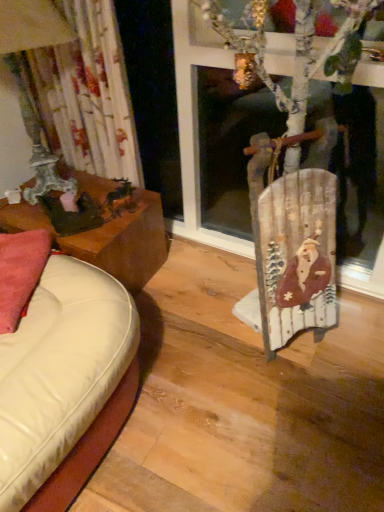
What do you see at coordinates (20, 273) in the screenshot? I see `pink fabric pillow at left` at bounding box center [20, 273].

Describe the element at coordinates (88, 94) in the screenshot. I see `floral fabric curtain at left` at that location.

What is the approximate width of floral fabric curtain at left?

The width of floral fabric curtain at left is 13.83 inches.

Where is `wooden sled at right`? wooden sled at right is located at coordinates (292, 242).

Identify the location of chair that appears above the brown wooden table at left (from a real-world perspective). This screenshot has width=384, height=512. (292, 242).

Is wooden sled at right oriented away from brown wooden table at left?

No, wooden sled at right is not facing the opposite direction of brown wooden table at left.

Does wooden sled at right lie behind brown wooden table at left?

No, wooden sled at right is in front of brown wooden table at left.

Looking at this image, from a real-world perspective, between brown wooden table at left and wooden sled at right, who is vertically lower?

brown wooden table at left is physically lower.

From the picture: Which of these two, brown wooden table at left or wooden sled at right, stands taller?

With more height is wooden sled at right.

Is brown wooden table at left inside or outside of wooden sled at right?

The correct answer is: outside.

Is brown wooden table at left looking in the opposite direction of wooden sled at right?

brown wooden table at left is not turned away from wooden sled at right.

From a real-world perspective, who is located lower, brown wooden table at left or floral fabric curtain at left?

brown wooden table at left is physically lower.

Between brown wooden table at left and floral fabric curtain at left, which one has more height?

Standing taller between the two is floral fabric curtain at left.

Between brown wooden table at left and floral fabric curtain at left, which one has smaller size?

Smaller between the two is floral fabric curtain at left.

Is point (73, 243) positioned after point (110, 7)?

Yes, it is behind point (110, 7).

Is pink fabric pillow at left taller or shorter than brown wooden table at left?

Clearly, pink fabric pillow at left is shorter compared to brown wooden table at left.

From a real-world perspective, does pink fabric pillow at left stand above brown wooden table at left?

Indeed, from a real-world perspective, pink fabric pillow at left stands above brown wooden table at left.

Between pink fabric pillow at left and brown wooden table at left, which one has smaller size?

Smaller between the two is pink fabric pillow at left.

Would you say pink fabric pillow at left is inside or outside brown wooden table at left?

pink fabric pillow at left is not inside brown wooden table at left, it's outside.

In the scene shown: Can you tell me how much brown wooden table at left and pink fabric pillow at left differ in facing direction?

There is a 29.1-degree angle between the facing directions of brown wooden table at left and pink fabric pillow at left.

Would you say brown wooden table at left contains pink fabric pillow at left?

No, pink fabric pillow at left is not surrounded by brown wooden table at left.

Considering the points (151, 227) and (21, 263), which point is behind, point (151, 227) or point (21, 263)?

Positioned behind is point (151, 227).

Does brown wooden table at left come in front of pink fabric pillow at left?

No, the depth of brown wooden table at left is greater than that of pink fabric pillow at left.

From a real-world perspective, relative to brown wooden table at left, is floral fabric curtain at left vertically above or below?

floral fabric curtain at left is situated higher than brown wooden table at left in the real world.

Is floral fabric curtain at left directly adjacent to brown wooden table at left?

floral fabric curtain at left and brown wooden table at left are clearly separated.

Does floral fabric curtain at left have a greater height compared to brown wooden table at left?

Correct, floral fabric curtain at left is much taller as brown wooden table at left.

Could you tell me if floral fabric curtain at left is turned towards brown wooden table at left?

No, floral fabric curtain at left is not aimed at brown wooden table at left.

Looking at this image, is floral fabric curtain at left closer to the viewer compared to pink fabric pillow at left?

No, it is behind pink fabric pillow at left.

Considering the positions of point (78, 112) and point (11, 310), is point (78, 112) closer or farther from the camera than point (11, 310)?

Point (78, 112) is farther from the camera than point (11, 310).

From a real-world perspective, between floral fabric curtain at left and pink fabric pillow at left, who is vertically higher?

In real-world perspective, floral fabric curtain at left is above.

Are floral fabric curtain at left and pink fabric pillow at left located far from each other?

floral fabric curtain at left is near pink fabric pillow at left, not far away.

You are a GUI agent. You are given a task and a screenshot of the screen. Output one action in this format:
    pyautogui.click(x=<x>, y=<y>)
    Task: Click on the table above the wooden sled at right (from the image's perspective)
    This screenshot has width=384, height=512.
    Given the screenshot: What is the action you would take?
    click(x=107, y=238)

The image size is (384, 512). In the image, there is a brown wooden table at left. What are the coordinates of `chair below it (from the image's perspective)` in the screenshot? It's located at (292, 242).

Looking at the image, which one is located further to pink fabric pillow at left, brown wooden table at left or wooden sled at right?

wooden sled at right is positioned further to the anchor pink fabric pillow at left.

Considering their positions, is pink fabric pillow at left positioned further to floral fabric curtain at left than brown wooden table at left?

pink fabric pillow at left is further to floral fabric curtain at left.

From the image, which object appears to be farther from pink fabric pillow at left, floral fabric curtain at left or wooden sled at right?

wooden sled at right is further to pink fabric pillow at left.

Looking at the image, which one is located further to wooden sled at right, pink fabric pillow at left or brown wooden table at left?

pink fabric pillow at left is positioned further to the anchor wooden sled at right.

Which object lies further to the anchor point pink fabric pillow at left, wooden sled at right or floral fabric curtain at left?

The object further to pink fabric pillow at left is wooden sled at right.

Which object lies further to the anchor point wooden sled at right, floral fabric curtain at left or brown wooden table at left?

floral fabric curtain at left lies further to wooden sled at right than the other object.

Looking at this image, from the image, which object appears to be farther from floral fabric curtain at left, wooden sled at right or pink fabric pillow at left?

The object further to floral fabric curtain at left is wooden sled at right.

From the image, which object appears to be farther from wooden sled at right, floral fabric curtain at left or pink fabric pillow at left?

floral fabric curtain at left is further to wooden sled at right.

Locate an element on the screen. The height and width of the screenshot is (512, 384). table between floral fabric curtain at left and wooden sled at right from left to right is located at coordinates (107, 238).

Identify the location of pillow situated between floral fabric curtain at left and wooden sled at right from left to right. [20, 273].

At what (x,y) coordinates should I click in order to perform the action: click on table between floral fabric curtain at left and pink fabric pillow at left vertically. Please return your answer as a coordinate pair (x, y). The image size is (384, 512). Looking at the image, I should click on (107, 238).

What are the coordinates of `table between pink fabric pillow at left and wooden sled at right in the horizontal direction` in the screenshot? It's located at (107, 238).